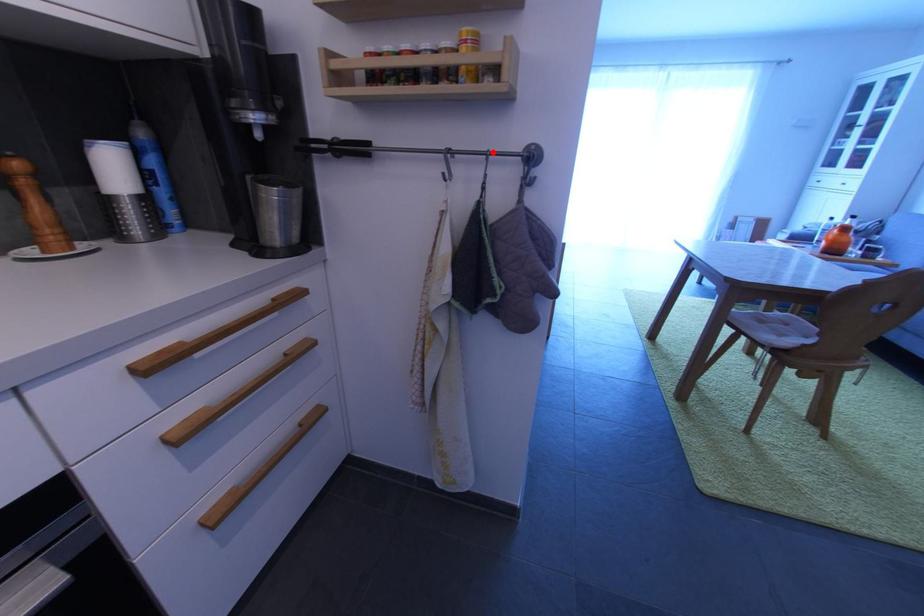
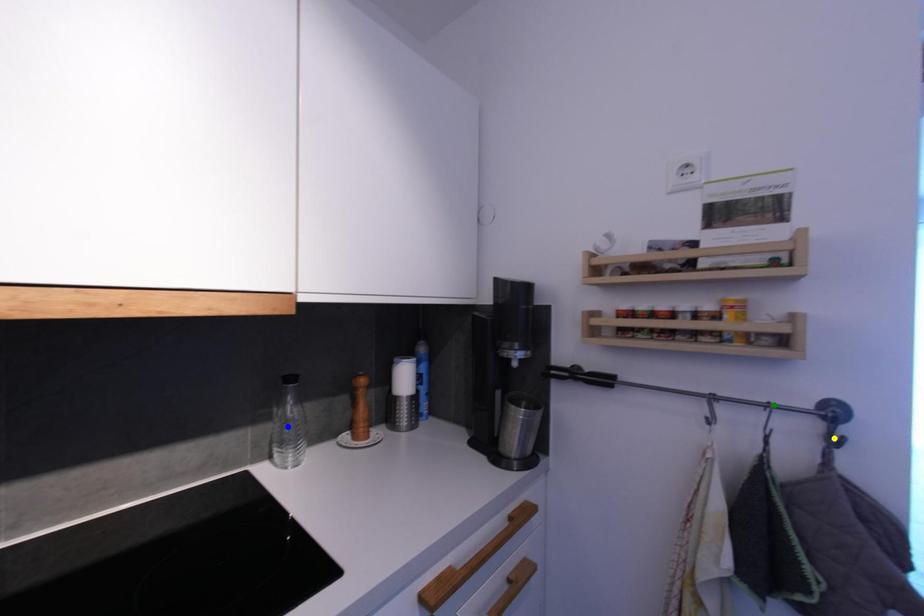
Question: I am providing you with two images of the same scene from different viewpoints. A red point is marked on the first image. You are given multiple points on the second image. Which point in image 2 is actually the same real-world point as the red point in image 1?

Choices:
 (A) yellow point
 (B) green point
 (C) blue point

Answer: (B)